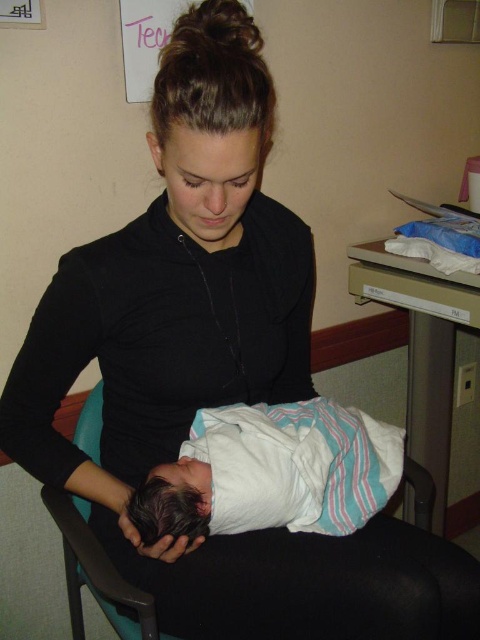
You are a nurse in a hospital room and need to place a medical chart on the surface of the black fabric chair at lower center. However, there is a white striped swaddle at center currently covering it. Can you place the chart directly on the chair without moving the swaddle?

The white striped swaddle at center is in front of the black fabric chair at lower center, meaning it is covering the chair. Therefore, you cannot place the chart directly on the chair without moving the swaddle.

You are a nurse in a hospital room and need to determine which item is narrower between the white striped swaddle at center and the black fabric chair at lower center. Which one is it?

The white striped swaddle at center is thinner than the black fabric chair at lower center, so the white striped swaddle at center is narrower.